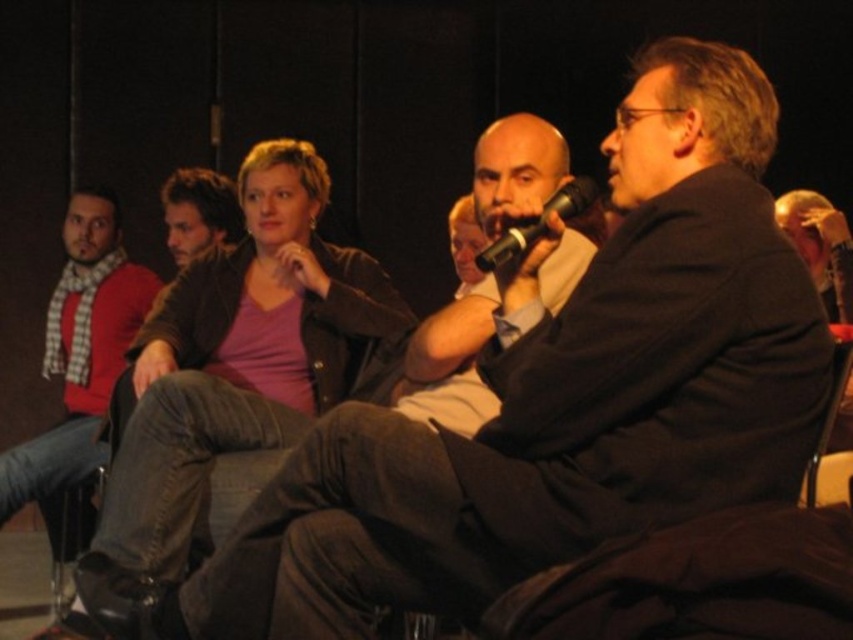
You are a sound technician in a live event. You need to adjust the volume for the microphone that is closest to the red checkered scarf at left. Is the black matte microphone at center the one you should adjust?

The distance between the red checkered scarf at left and the black matte microphone at center is 6.56 feet. Since the black matte microphone at center is the closest microphone to the red checkered scarf at left, you should adjust its volume.

You are a photographer standing at the camera position. You want to take a photo of the pink matte jacket at upper center. Is it within your reach to adjust its position without moving the camera?

The pink matte jacket at upper center is 1.99 meters from camera, so it is within reach to adjust its position without moving the camera.

You are organizing a clothing donation drive and need to determine which item takes up more space when packing. Which item between the pink matte jacket at upper center and the red checkered scarf at left is larger in size?

The pink matte jacket at upper center is bigger than the red checkered scarf at left, so it takes up more space when packing.